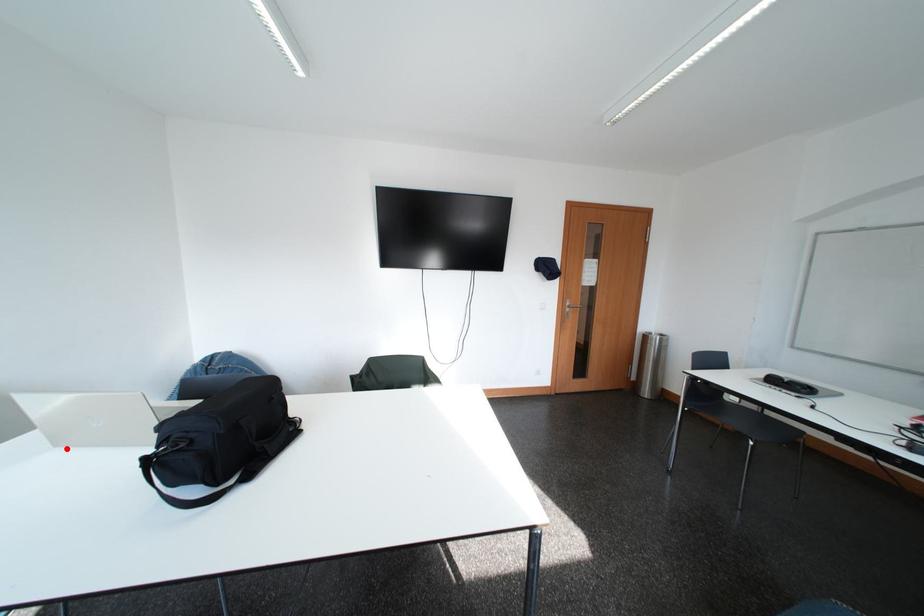
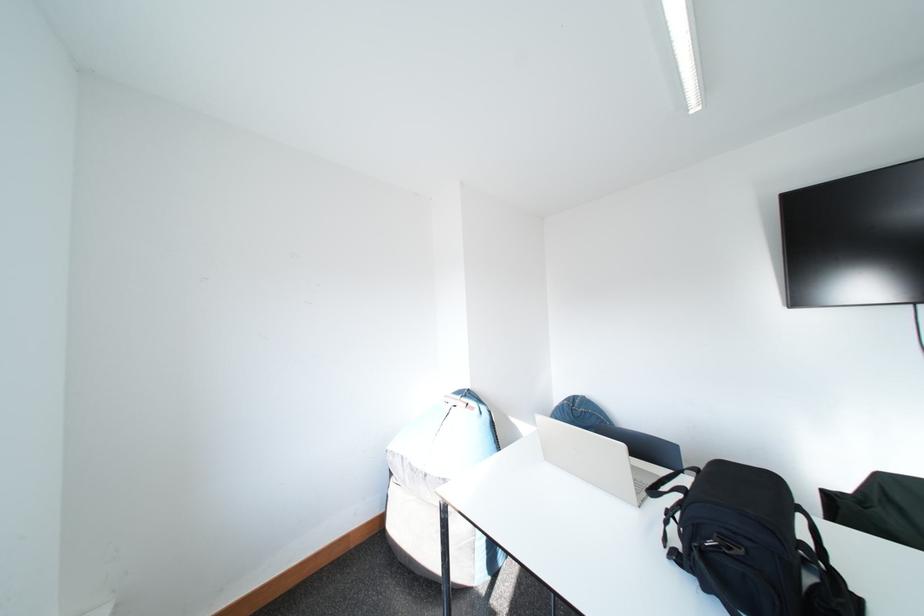
Where in the second image is the point corresponding to the highlighted location from the first image?

(557, 463)